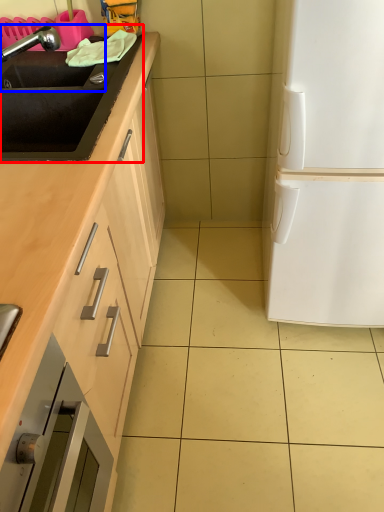
Question: Among these objects, which one is nearest to the camera, sink (highlighted by a red box) or sink (highlighted by a blue box)?

Choices:
 (A) sink
 (B) sink

Answer: (A)